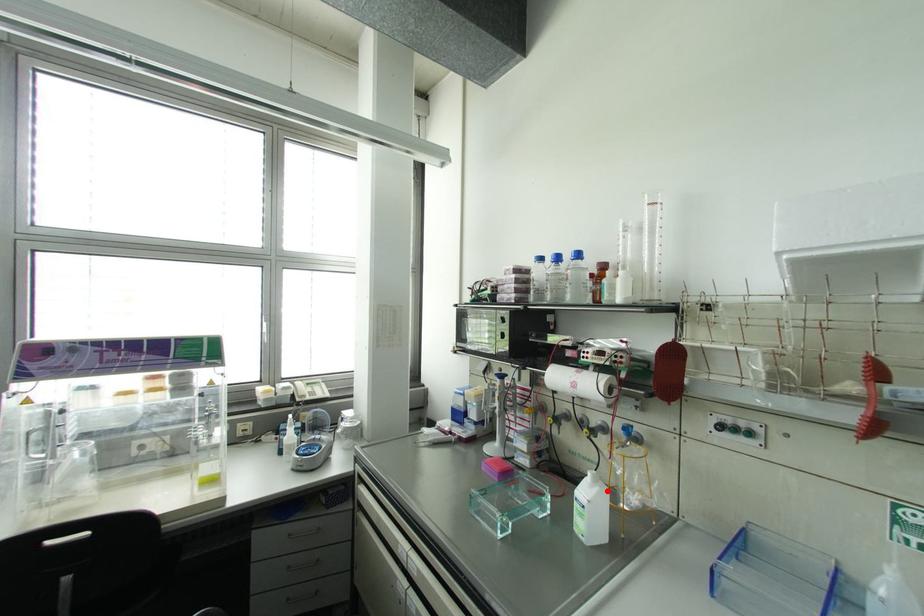
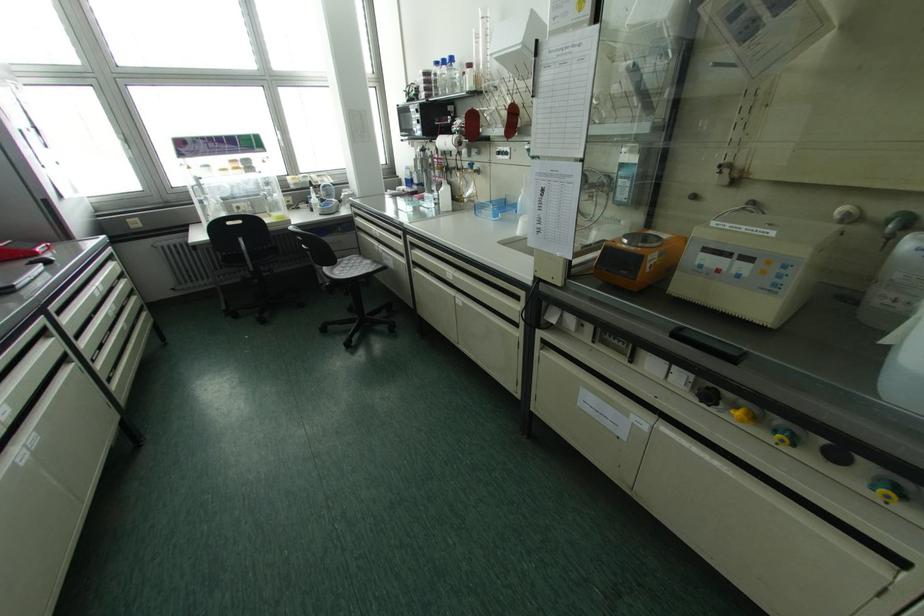
Locate, in the second image, the point that corresponds to the highlighted location in the first image.

(448, 187)